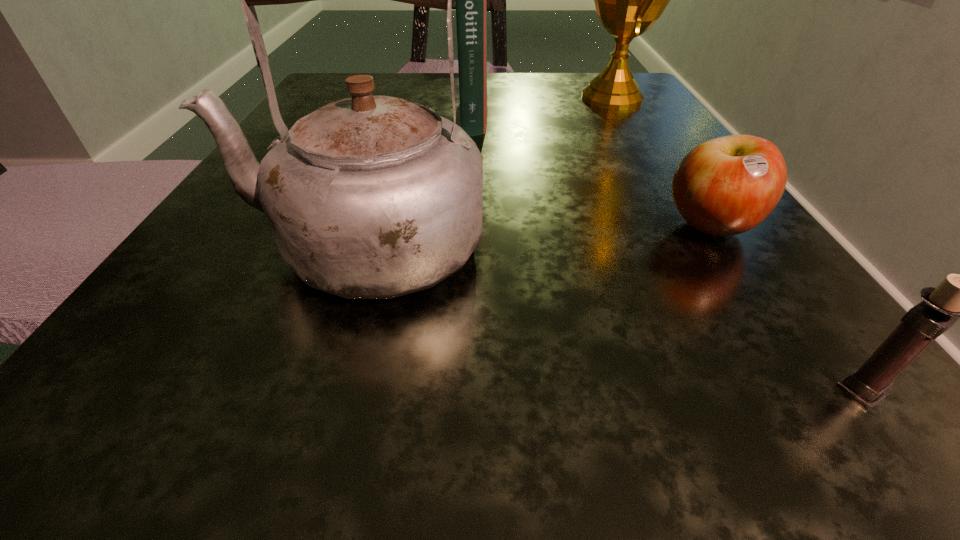
You are a GUI agent. You are given a task and a screenshot of the screen. Output one action in this format:
    pyautogui.click(x=<x>, y=<y>)
    Task: Click on the vacant region that satisfies the following two spatial constraints: 1. on the cover of the hardback book; 2. on the right side of the shortest object
    This screenshot has width=960, height=540.
    Given the screenshot: What is the action you would take?
    pyautogui.click(x=470, y=227)

Locate an element on the screen. Image resolution: width=960 pixels, height=540 pixels. free region that satisfies the following two spatial constraints: 1. on the front-facing side of the award; 2. on the back side of the shortest object is located at coordinates (689, 227).

This screenshot has width=960, height=540. Identify the location of free space that satisfies the following two spatial constraints: 1. on the cover of the hardback book; 2. on the left side of the shortest object. (470, 227).

At what (x,y) coordinates should I click in order to perform the action: click on free location that satisfies the following two spatial constraints: 1. on the front-facing side of the shortest object; 2. on the right side of the award. Please return your answer as a coordinate pair (x, y). This screenshot has height=540, width=960. Looking at the image, I should click on (689, 227).

Image resolution: width=960 pixels, height=540 pixels. I want to click on free space that satisfies the following two spatial constraints: 1. on the cover of the apple; 2. on the right side of the hardback book, so click(470, 227).

Where is `vacant space that satisfies the following two spatial constraints: 1. on the front-facing side of the award; 2. on the left side of the nearest object`? vacant space that satisfies the following two spatial constraints: 1. on the front-facing side of the award; 2. on the left side of the nearest object is located at coordinates (787, 390).

Locate an element on the screen. This screenshot has width=960, height=540. vacant area in the image that satisfies the following two spatial constraints: 1. on the cover of the hardback book; 2. on the back side of the candle holder is located at coordinates (466, 390).

The image size is (960, 540). I want to click on free space in the image that satisfies the following two spatial constraints: 1. on the back side of the shortest object; 2. on the front-facing side of the award, so click(624, 98).

Image resolution: width=960 pixels, height=540 pixels. I want to click on vacant space that satisfies the following two spatial constraints: 1. on the back side of the apple; 2. on the cover of the hardback book, so click(x=634, y=113).

Locate an element on the screen. This screenshot has width=960, height=540. vacant space that satisfies the following two spatial constraints: 1. at the spout of the kettle; 2. on the left side of the shortest object is located at coordinates (369, 227).